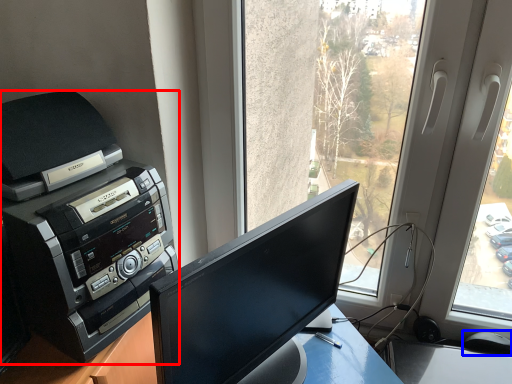
Question: Among these objects, which one is nearest to the camera, printer (highlighted by a red box) or mouse (highlighted by a blue box)?

Choices:
 (A) printer
 (B) mouse

Answer: (A)